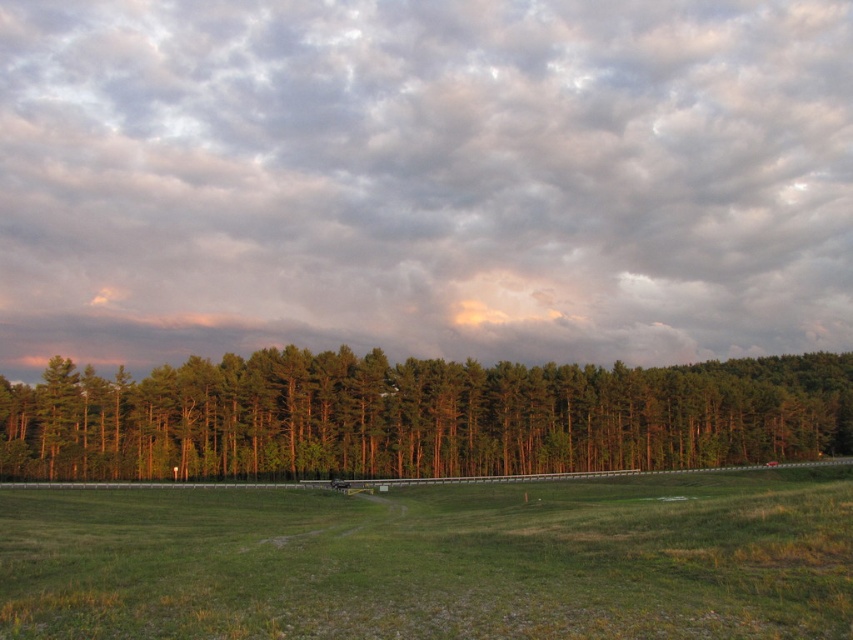
Looking at this image, is cloudy sky at upper center above green matte trees at center?

Yes.

Is cloudy sky at upper center shorter than green matte trees at center?

No, cloudy sky at upper center is not shorter than green matte trees at center.

Between point (112, 252) and point (479, 451), which one is positioned in front?

Point (479, 451) is in front.

This screenshot has width=853, height=640. Find the location of `cloudy sky at upper center`. cloudy sky at upper center is located at coordinates (424, 179).

Can you confirm if cloudy sky at upper center is thinner than green grass at center?

No.

Is cloudy sky at upper center positioned before green grass at center?

No, it is behind green grass at center.

Which is behind, point (622, 276) or point (790, 584)?

Point (622, 276)

Where is `cloudy sky at upper center`? This screenshot has width=853, height=640. cloudy sky at upper center is located at coordinates (424, 179).

Looking at this image, is green grass at center to the left of green matte trees at center from the viewer's perspective?

Indeed, green grass at center is positioned on the left side of green matte trees at center.

Is green grass at center positioned behind green matte trees at center?

That is False.

This screenshot has width=853, height=640. Identify the location of green grass at center. (436, 561).